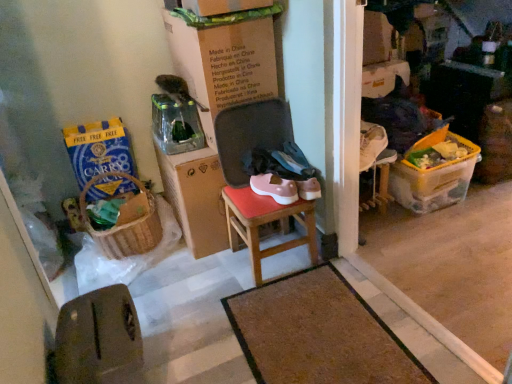
Question: Would you consider blue paper bag at left, arranged as the second box when viewed from the right, to be distant from cardboard box at center?

Choices:
 (A) yes
 (B) no

Answer: (B)

Question: Can you confirm if blue paper bag at left, which is the first box in left-to-right order, is bigger than cardboard box at center?

Choices:
 (A) no
 (B) yes

Answer: (A)

Question: Is blue paper bag at left, which is the first box in left-to-right order, looking in the opposite direction of cardboard box at center?

Choices:
 (A) yes
 (B) no

Answer: (B)

Question: Can you confirm if blue paper bag at left, which is the first box in left-to-right order, is taller than cardboard box at center?

Choices:
 (A) yes
 (B) no

Answer: (B)

Question: From a real-world perspective, is blue paper bag at left, arranged as the second box when viewed from the right, physically above cardboard box at center?

Choices:
 (A) yes
 (B) no

Answer: (B)

Question: Considering the positions of brown textured mat at center and blue paper bag at left, which is the first box in left-to-right order, in the image, is brown textured mat at center wider or thinner than blue paper bag at left, which is the first box in left-to-right order,?

Choices:
 (A) wide
 (B) thin

Answer: (A)

Question: From the image's perspective, is brown textured mat at center above or below blue paper bag at left, which is the first box in left-to-right order?

Choices:
 (A) above
 (B) below

Answer: (B)

Question: Considering the relative positions of brown textured mat at center and blue paper bag at left, which is the first box in left-to-right order, in the image provided, is brown textured mat at center to the left or to the right of blue paper bag at left, which is the first box in left-to-right order,?

Choices:
 (A) left
 (B) right

Answer: (B)

Question: Is brown textured mat at center in front of or behind blue paper bag at left, which is the first box in left-to-right order, in the image?

Choices:
 (A) front
 (B) behind

Answer: (A)

Question: Looking at their shapes, would you say blue paper bag at left, which is the first box in left-to-right order, is wider or thinner than brown textured mat at center?

Choices:
 (A) wide
 (B) thin

Answer: (B)

Question: Considering the positions of blue paper bag at left, arranged as the second box when viewed from the right, and brown textured mat at center in the image, is blue paper bag at left, arranged as the second box when viewed from the right, taller or shorter than brown textured mat at center?

Choices:
 (A) short
 (B) tall

Answer: (B)

Question: Does point (99, 163) appear closer or farther from the camera than point (379, 332)?

Choices:
 (A) closer
 (B) farther

Answer: (B)

Question: Would you say blue paper bag at left, which is the first box in left-to-right order, is to the left or to the right of brown textured mat at center in the picture?

Choices:
 (A) right
 (B) left

Answer: (B)

Question: Does point (113, 357) appear closer or farther from the camera than point (238, 241)?

Choices:
 (A) farther
 (B) closer

Answer: (B)

Question: From a real-world perspective, is brown leather chair at lower left positioned above or below wooden stool at center?

Choices:
 (A) above
 (B) below

Answer: (A)